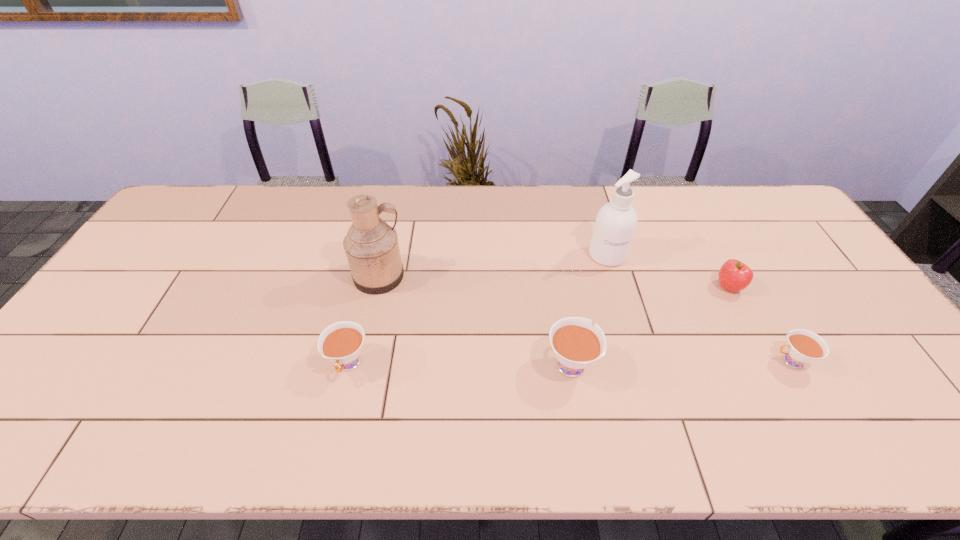
The image size is (960, 540). Find the location of `vacant space located 0.170m on the side of the third object from left to right with the handle`. vacant space located 0.170m on the side of the third object from left to right with the handle is located at coordinates (558, 290).

Identify the location of free region located 0.240m on the side of the rightmost teacup with the handle. This screenshot has height=540, width=960. (674, 361).

Locate an element on the screen. free space located on the side of the rightmost teacup with the handle is located at coordinates (710, 361).

You are a GUI agent. You are given a task and a screenshot of the screen. Output one action in this format:
    pyautogui.click(x=<x>, y=<y>)
    Task: Click on the vacant space located on the side of the rightmost teacup with the handle
    
    Given the screenshot: What is the action you would take?
    pyautogui.click(x=642, y=361)

This screenshot has width=960, height=540. In order to click on vacant space located on the front label of the fourth object from left to right in this screenshot , I will do `click(631, 335)`.

Where is `free space located 0.250m on the right of the pitcher`? This screenshot has height=540, width=960. free space located 0.250m on the right of the pitcher is located at coordinates (491, 276).

The width and height of the screenshot is (960, 540). What are the coordinates of `vacant space situated 0.100m on the back of the apple` in the screenshot? It's located at (710, 254).

Identify the location of vacant space at the far edge of the desktop. (674, 220).

In the image, there is a desktop. Identify the location of vacant space at the near edge. The height and width of the screenshot is (540, 960). (217, 406).

The image size is (960, 540). What are the coordinates of `vacant region at the left edge of the desktop` in the screenshot? It's located at (177, 262).